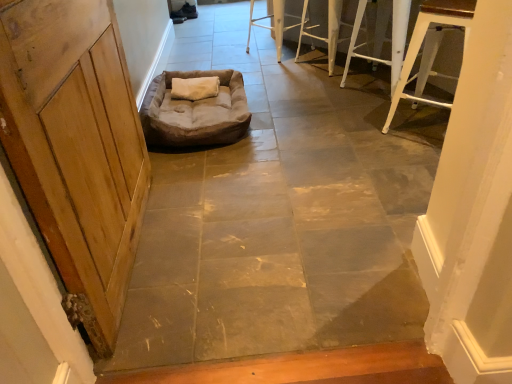
What do you see at coordinates (273, 23) in the screenshot? The width and height of the screenshot is (512, 384). I see `white metal stool at upper center, placed as the 1th furniture when sorted from back to front` at bounding box center [273, 23].

Locate an element on the screen. Image resolution: width=512 pixels, height=384 pixels. white metal stool at upper center, placed as the 1th furniture when sorted from back to front is located at coordinates (273, 23).

Describe the element at coordinates (195, 112) in the screenshot. I see `brown suede dog bed at center` at that location.

What do you see at coordinates (281, 214) in the screenshot?
I see `brown fabric dog bed at center` at bounding box center [281, 214].

In order to face white metal stool at upper right, the third furniture viewed from the front, should I rotate leftwards or rightwards?

A 10.398 degree turn to the right will do.

The image size is (512, 384). What do you see at coordinates (429, 48) in the screenshot? I see `white metal stool at upper right, which is counted as the 1th furniture, starting from the front` at bounding box center [429, 48].

In order to click on white metal stool at upper center, marked as the 4th furniture in a front-to-back arrangement in this screenshot , I will do `click(273, 23)`.

From the image's perspective, which one is positioned higher, wooden door at left or white metal stool at upper right, acting as the fourth furniture starting from the back?

white metal stool at upper right, acting as the fourth furniture starting from the back, is shown above in the image.

Is wooden door at left positioned behind white metal stool at upper right, acting as the fourth furniture starting from the back?

No, wooden door at left is in front of white metal stool at upper right, acting as the fourth furniture starting from the back.

From a real-world perspective, which is physically above, wooden door at left or white metal stool at upper right, which is counted as the 1th furniture, starting from the front?

wooden door at left is physically above.

How distant is wooden door at left from white metal stool at upper right, acting as the fourth furniture starting from the back?

5.17 feet.

From the image's perspective, is brown suede dog bed at center above white metal stool at upper center, marked as the 4th furniture in a front-to-back arrangement?

Actually, brown suede dog bed at center appears below white metal stool at upper center, marked as the 4th furniture in a front-to-back arrangement, in the image.

How many degrees apart are the facing directions of brown suede dog bed at center and white metal stool at upper center, marked as the 4th furniture in a front-to-back arrangement?

The angular difference between brown suede dog bed at center and white metal stool at upper center, marked as the 4th furniture in a front-to-back arrangement, is 39.2 degrees.

Is brown suede dog bed at center to the right of white metal stool at upper center, placed as the 1th furniture when sorted from back to front, from the viewer's perspective?

In fact, brown suede dog bed at center is to the left of white metal stool at upper center, placed as the 1th furniture when sorted from back to front.

How distant is brown suede dog bed at center from white metal stool at upper center, marked as the 4th furniture in a front-to-back arrangement?

brown suede dog bed at center and white metal stool at upper center, marked as the 4th furniture in a front-to-back arrangement, are 3.50 feet apart.

From their relative heights in the image, would you say brown suede dog bed at center is taller or shorter than white metal stool at upper right, acting as the fourth furniture starting from the back?

Considering their sizes, brown suede dog bed at center has less height than white metal stool at upper right, acting as the fourth furniture starting from the back.

Can you confirm if brown suede dog bed at center is wider than white metal stool at upper right, acting as the fourth furniture starting from the back?

Yes.

Could you tell me if brown suede dog bed at center is facing white metal stool at upper right, acting as the fourth furniture starting from the back?

No, brown suede dog bed at center is not aimed at white metal stool at upper right, acting as the fourth furniture starting from the back.

Does point (241, 112) appear closer or farther from the camera than point (403, 88)?

Point (241, 112).

Is white metal stool at upper right, the third furniture from the back, in contact with white metal stool at upper center, placed as the 1th furniture when sorted from back to front?

No, white metal stool at upper right, the third furniture from the back, is not with white metal stool at upper center, placed as the 1th furniture when sorted from back to front.

Could white metal stool at upper center, marked as the 4th furniture in a front-to-back arrangement, be considered to be inside white metal stool at upper right, the third furniture from the back?

Definitely not — white metal stool at upper center, marked as the 4th furniture in a front-to-back arrangement, is not inside white metal stool at upper right, the third furniture from the back.

From a real-world perspective, is white metal stool at upper right, the third furniture from the back, positioned over white metal stool at upper center, marked as the 4th furniture in a front-to-back arrangement, based on gravity?

Yes, from a real-world perspective, white metal stool at upper right, the third furniture from the back, is over white metal stool at upper center, marked as the 4th furniture in a front-to-back arrangement

Does white metal stool at upper right, which is counted as the 1th furniture, starting from the front, turn towards white metal stool at upper right, the second furniture positioned from the front?

No, white metal stool at upper right, which is counted as the 1th furniture, starting from the front, is not facing towards white metal stool at upper right, the second furniture positioned from the front.

From a real-world perspective, is white metal stool at upper right, which is counted as the 1th furniture, starting from the front, physically above white metal stool at upper right, the third furniture from the back?

Yes, from a real-world perspective, white metal stool at upper right, which is counted as the 1th furniture, starting from the front, is above white metal stool at upper right, the third furniture from the back.

Which point is more distant from viewer, [413,47] or [399,5]?

The point [399,5] is farther.

At what (x,y) coordinates should I click in order to perform the action: click on the 1st furniture above when counting from the white metal stool at upper right, which is counted as the 1th furniture, starting from the front (from the image's perspective). Please return your answer as a coordinate pair (x, y). This screenshot has width=512, height=384. Looking at the image, I should click on (382, 36).

Considering the sizes of white metal stool at upper right, which is counted as the 1th furniture, starting from the front, and brown fabric dog bed at center in the image, is white metal stool at upper right, which is counted as the 1th furniture, starting from the front, wider or thinner than brown fabric dog bed at center?

Considering their sizes, white metal stool at upper right, which is counted as the 1th furniture, starting from the front, looks broader than brown fabric dog bed at center.

Considering the relative sizes of white metal stool at upper right, which is counted as the 1th furniture, starting from the front, and brown fabric dog bed at center in the image provided, is white metal stool at upper right, which is counted as the 1th furniture, starting from the front, taller than brown fabric dog bed at center?

In fact, white metal stool at upper right, which is counted as the 1th furniture, starting from the front, may be shorter than brown fabric dog bed at center.

From a real-world perspective, is white metal stool at upper right, acting as the fourth furniture starting from the back, beneath brown fabric dog bed at center?

Yes, from a real-world perspective, white metal stool at upper right, acting as the fourth furniture starting from the back, is beneath brown fabric dog bed at center.

From the image's perspective, is white metal stool at upper right, which is counted as the 1th furniture, starting from the front, above or below brown fabric dog bed at center?

Clearly, from the image's perspective, white metal stool at upper right, which is counted as the 1th furniture, starting from the front, is above brown fabric dog bed at center.

Is there a large distance between brown fabric dog bed at center and white metal stool at upper right, acting as the fourth furniture starting from the back?

No.

Which is behind, point (175, 292) or point (407, 67)?

The point (407, 67) is farther.

Is brown fabric dog bed at center bigger or smaller than white metal stool at upper right, acting as the fourth furniture starting from the back?

Considering their sizes, brown fabric dog bed at center takes up less space than white metal stool at upper right, acting as the fourth furniture starting from the back.

From a real-world perspective, starting from the wooden door at left, which furniture is the 1st one below it? Please provide its 2D coordinates.

[(429, 48)]

At what (x,y) coordinates should I click in order to perform the action: click on dog bed in front of the white metal stool at upper center, placed as the 1th furniture when sorted from back to front. Please return your answer as a coordinate pair (x, y). This screenshot has height=384, width=512. Looking at the image, I should click on (195, 112).

Considering their positions, is wooden door at left positioned further to brown suede dog bed at center than brown fabric dog bed at center?

wooden door at left lies further to brown suede dog bed at center than the other object.

In the scene shown: Considering their positions, is wooden door at left positioned further to brown fabric dog bed at center than white metal stool at upper right, which is counted as the 1th furniture, starting from the front?

wooden door at left lies further to brown fabric dog bed at center than the other object.

From the image, which object appears to be farther from white metal stool at upper center, marked as the 4th furniture in a front-to-back arrangement, brown fabric dog bed at center or white metal stool at upper right, which is counted as the 1th furniture, starting from the front?

The object further to white metal stool at upper center, marked as the 4th furniture in a front-to-back arrangement, is brown fabric dog bed at center.

From the image, which object appears to be nearer to white metal stool at upper right, the third furniture viewed from the front, wooden door at left or white metal stool at upper center, marked as the 4th furniture in a front-to-back arrangement?

white metal stool at upper center, marked as the 4th furniture in a front-to-back arrangement.

Considering their positions, is brown suede dog bed at center positioned closer to white metal stool at upper right, which is counted as the 2th furniture, starting from the back, than brown fabric dog bed at center?

brown fabric dog bed at center lies closer to white metal stool at upper right, which is counted as the 2th furniture, starting from the back, than the other object.

Which object lies nearer to the anchor point white metal stool at upper right, the second furniture positioned from the front, wooden door at left or white metal stool at upper right, acting as the fourth furniture starting from the back?

white metal stool at upper right, acting as the fourth furniture starting from the back.

Based on their spatial positions, is wooden door at left or white metal stool at upper center, placed as the 1th furniture when sorted from back to front, closer to white metal stool at upper right, acting as the fourth furniture starting from the back?

Among the two, white metal stool at upper center, placed as the 1th furniture when sorted from back to front, is located nearer to white metal stool at upper right, acting as the fourth furniture starting from the back.

From the image, which object appears to be farther from white metal stool at upper right, the third furniture viewed from the front, wooden door at left or white metal stool at upper right, the second furniture positioned from the front?

Among the two, wooden door at left is located further to white metal stool at upper right, the third furniture viewed from the front.

Image resolution: width=512 pixels, height=384 pixels. In order to click on furniture between white metal stool at upper right, acting as the fourth furniture starting from the back, and white metal stool at upper right, which is counted as the 2th furniture, starting from the back, along the z-axis in this screenshot , I will do `click(382, 36)`.

Identify the location of dog bed between wooden door at left and white metal stool at upper center, placed as the 1th furniture when sorted from back to front, along the z-axis. Image resolution: width=512 pixels, height=384 pixels. (195, 112).

Image resolution: width=512 pixels, height=384 pixels. I want to click on dog bed between brown fabric dog bed at center and white metal stool at upper right, the second furniture positioned from the front, along the z-axis, so click(x=195, y=112).

Find the location of a particular element. This screenshot has width=512, height=384. door between brown fabric dog bed at center and white metal stool at upper right, the second furniture positioned from the front, in the front-back direction is located at coordinates (76, 145).